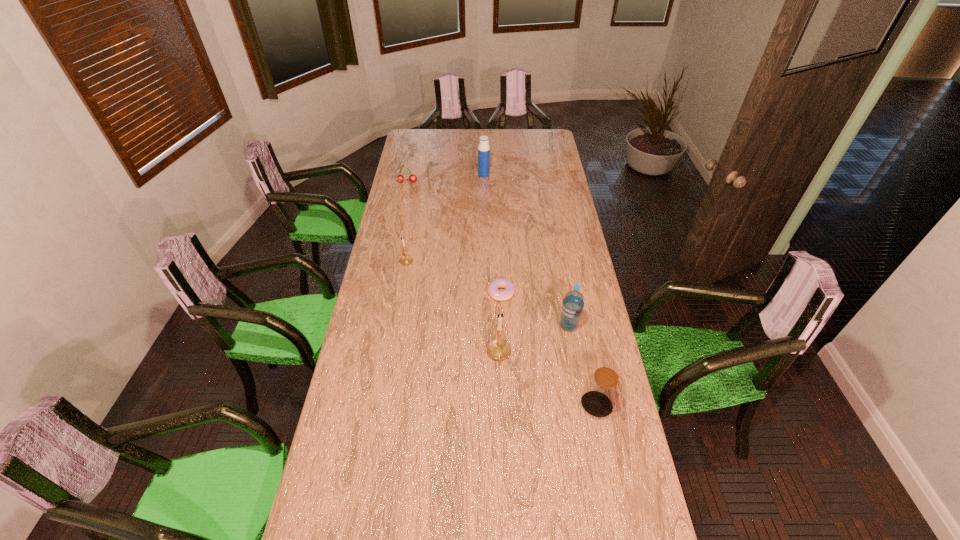
Point out which object is positioned as the sixth nearest to the fourth farthest object. Please provide its 2D coordinates. Your answer should be formatted as a tuple, i.e. [(x, y)], where the tuple contains the x and y coordinates of a point satisfying the conditions above.

[(400, 178)]

At what (x,y) coordinates should I click in order to perform the action: click on free space that satisfies the following two spatial constraints: 1. on the handle side of the taller candle holder; 2. on the right side of the nearest object. Please return your answer as a coordinate pair (x, y). The height and width of the screenshot is (540, 960). Looking at the image, I should click on (500, 405).

Locate an element on the screen. vacant space that satisfies the following two spatial constraints: 1. with stems pointing upwards on the fourth nearest object; 2. on the left side of the cherry is located at coordinates (384, 293).

Locate an element on the screen. The height and width of the screenshot is (540, 960). vacant space that satisfies the following two spatial constraints: 1. on the handle side of the left water bottle; 2. on the right side of the third shortest object is located at coordinates (421, 175).

The image size is (960, 540). In order to click on free space that satisfies the following two spatial constraints: 1. on the handle side of the nearest object; 2. on the right side of the nearer candle holder in this screenshot , I will do `click(500, 405)`.

Identify the location of free space that satisfies the following two spatial constraints: 1. on the handle side of the right candle holder; 2. on the right side of the jar. This screenshot has height=540, width=960. (500, 405).